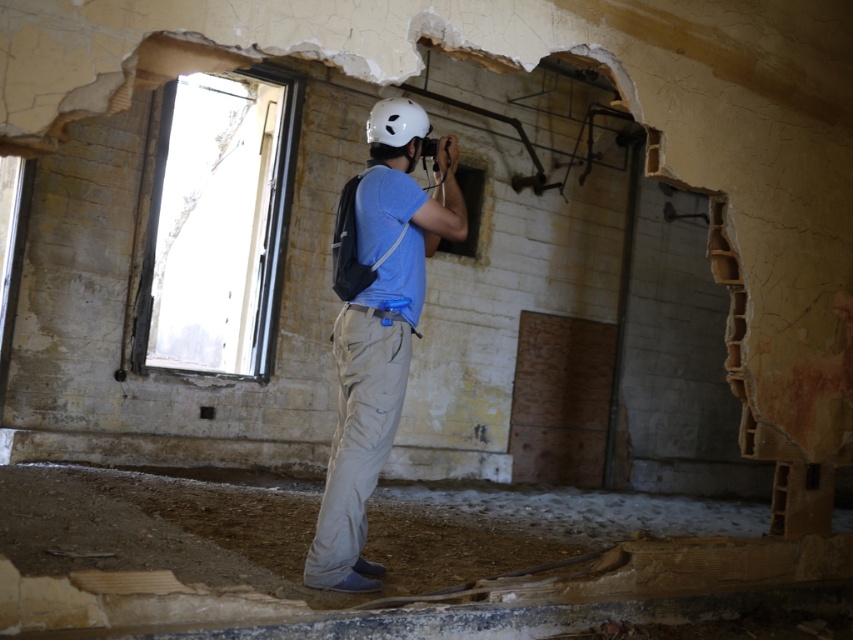
You are a photographer standing in a dilapidated building. You have a matte blue shirt at center and a smooth concrete hole at center in your view. Which object is positioned to the left side from your perspective?

The matte blue shirt at center is to the left of the smooth concrete hole at center.

You are a construction worker in the scene and need to safely move your white matte helmet at center to the smooth concrete hole at center. Given that the recommended safe distance for such a maneuver is 5 meters, can you proceed without violating safety protocols?

The white matte helmet at center is 4.33 meters away from the smooth concrete hole at center. Since the recommended safe distance is 5 meters, moving the helmet at this distance would violate safety protocols. Please increase the distance to at least 5 meters before proceeding.

You are a safety inspector in this abandoned building. You notice the matte blue shirt at center and the smooth concrete hole at center. Which object is wider?

The matte blue shirt at center might be wider than smooth concrete hole at center according to the description.